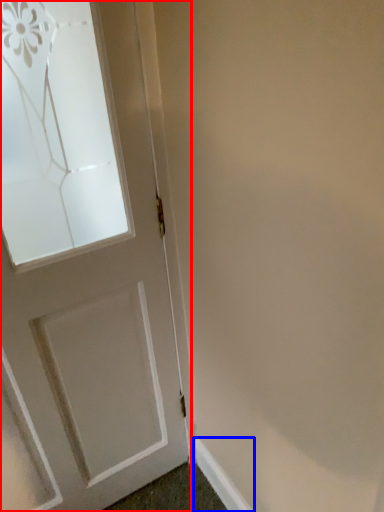
Question: Which object is further to the camera taking this photo, door (highlighted by a red box) or molding (highlighted by a blue box)?

Choices:
 (A) door
 (B) molding

Answer: (B)